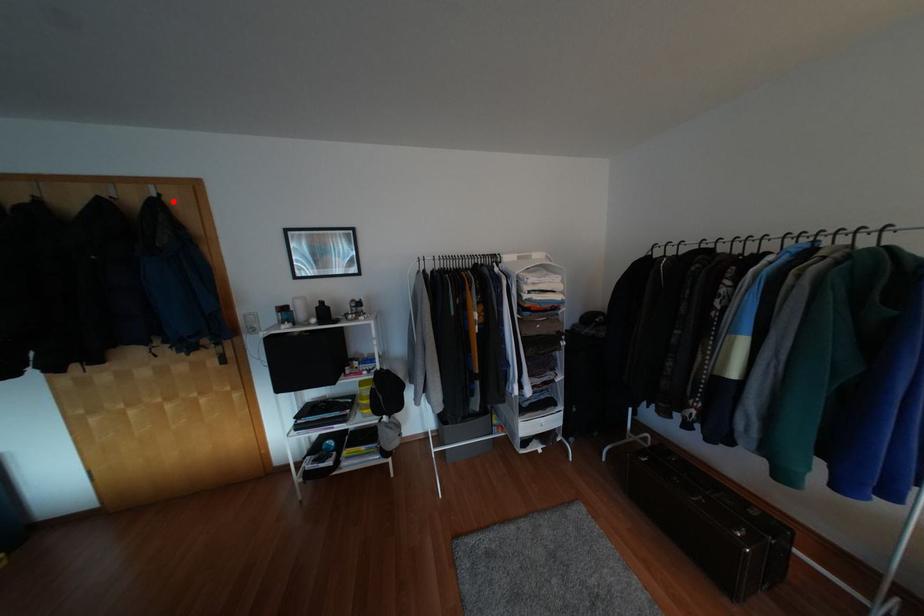
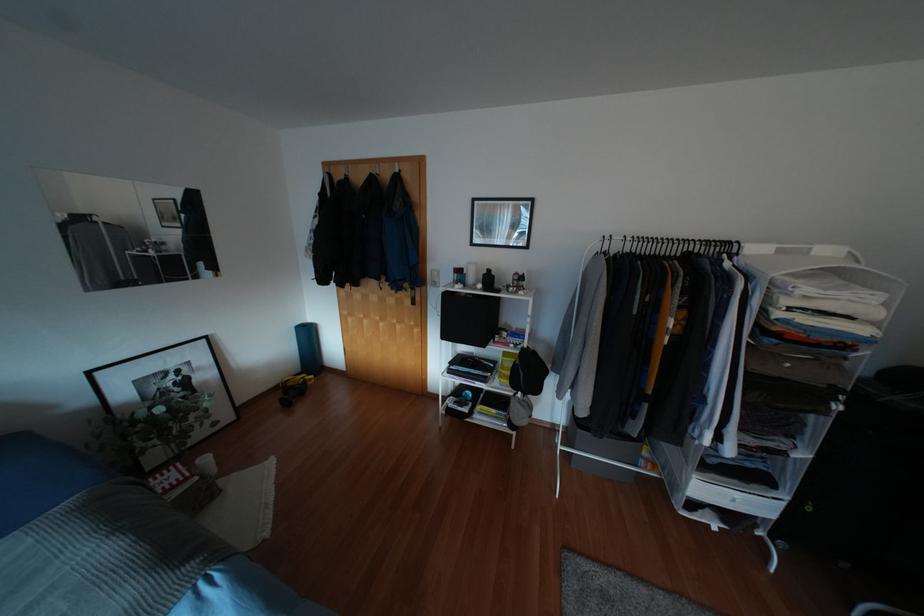
The point at the highlighted location is marked in the first image. Where is the corresponding point in the second image?

(406, 176)